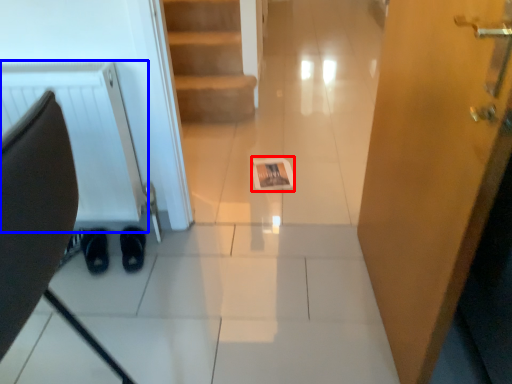
Question: Which point is closer to the camera, magazine (highlighted by a red box) or radiator (highlighted by a blue box)?

Choices:
 (A) magazine
 (B) radiator

Answer: (B)